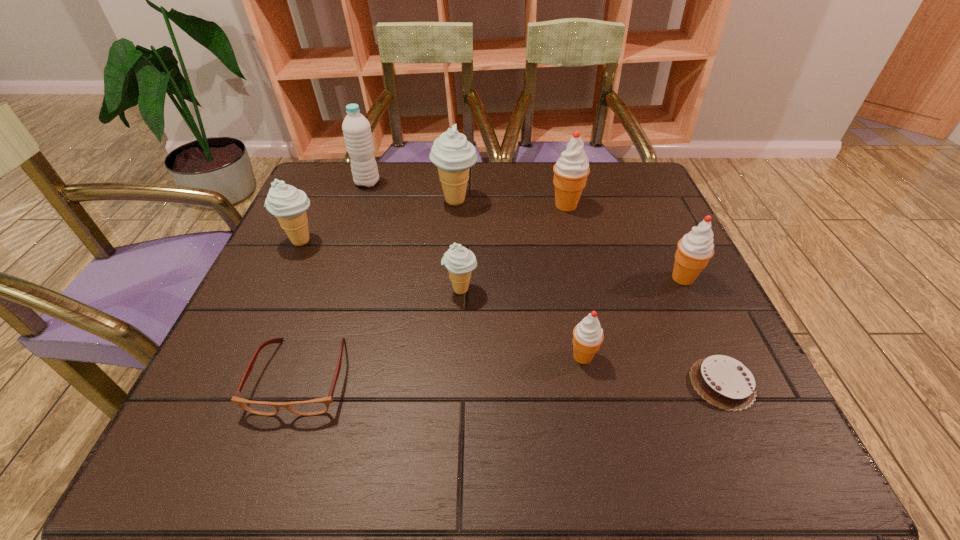
Locate an element on the screen. water bottle is located at coordinates (356, 128).

Locate an element on the screen. the biggest red icecream is located at coordinates (571, 170).

Image resolution: width=960 pixels, height=540 pixels. In order to click on the biggest beige icecream in this screenshot , I will do click(x=451, y=152).

Locate an element on the screen. This screenshot has height=540, width=960. the second smallest red icecream is located at coordinates (694, 250).

The image size is (960, 540). I want to click on the rightmost icecream, so click(694, 250).

You are a GUI agent. You are given a task and a screenshot of the screen. Output one action in this format:
    pyautogui.click(x=<x>, y=<y>)
    Task: Click on the leftmost beige icecream
    This screenshot has height=540, width=960.
    Given the screenshot: What is the action you would take?
    pyautogui.click(x=288, y=204)

Where is `the second smallest beige icecream`? the second smallest beige icecream is located at coordinates (288, 204).

Identify the location of the smallest beige icecream. (459, 261).

Locate an element on the screen. the smallest red icecream is located at coordinates (588, 335).

Identify the location of the nearest icecream. (588, 335).